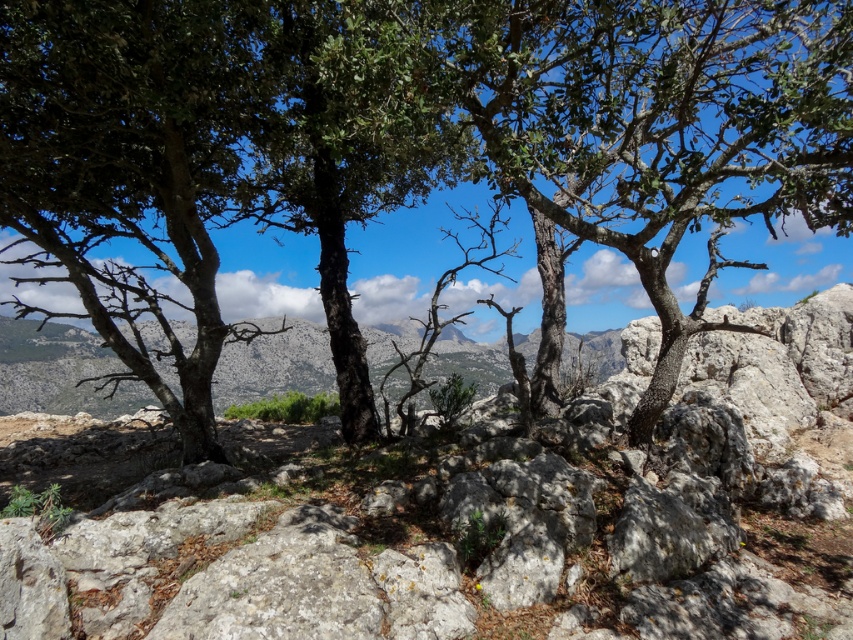
Question: Is green leafy tree at center positioned before gray rough rock at center?

Choices:
 (A) yes
 (B) no

Answer: (B)

Question: Is the position of green leafy tree at center more distant than that of gray rough rock at center?

Choices:
 (A) no
 (B) yes

Answer: (B)

Question: Does green leafy tree at center appear over gray rough rock at center?

Choices:
 (A) no
 (B) yes

Answer: (B)

Question: Which object is closer to the camera taking this photo?

Choices:
 (A) green leafy tree at center
 (B) gray rough rock at center

Answer: (B)

Question: Among these points, which one is nearest to the camera?

Choices:
 (A) (728, 262)
 (B) (44, 618)

Answer: (B)